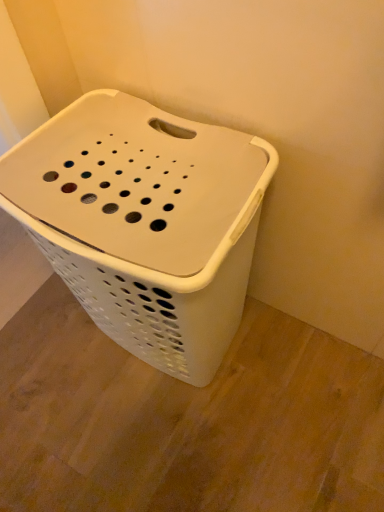
Image resolution: width=384 pixels, height=512 pixels. Find the location of `free space above white plastic laundry basket at center (from a real-world perspective)`. free space above white plastic laundry basket at center (from a real-world perspective) is located at coordinates (113, 174).